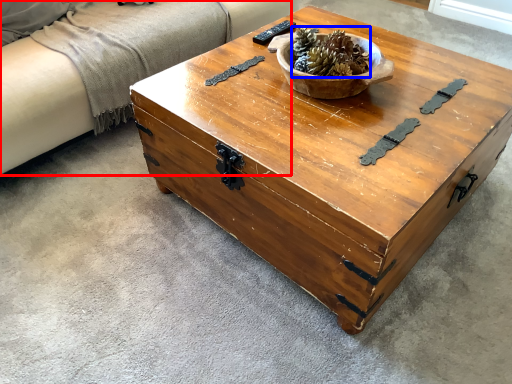
Question: Which of the following is the closest to the observer, couch (highlighted by a red box) or centerpiece (highlighted by a blue box)?

Choices:
 (A) couch
 (B) centerpiece

Answer: (B)